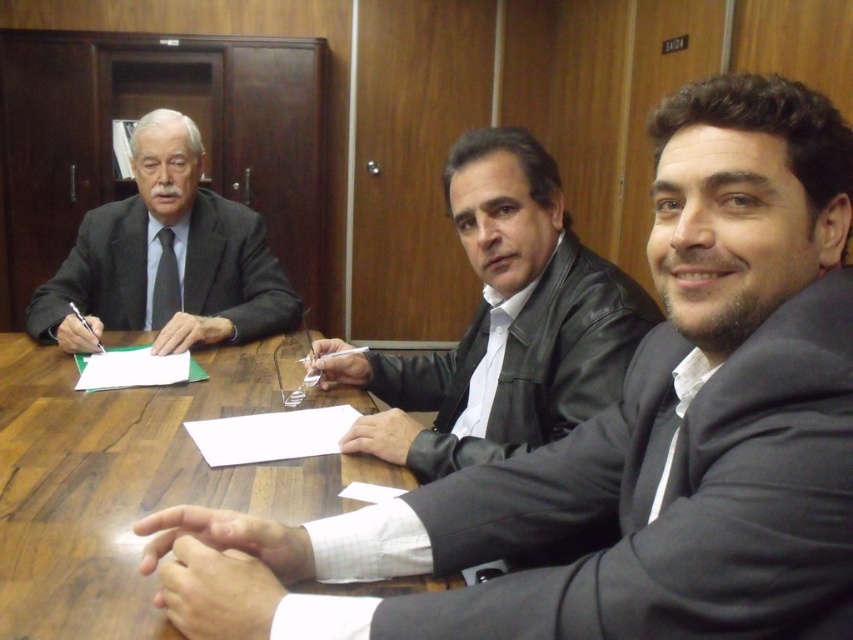
Question: Does leather jacket at center lie in front of matte black suit at left?

Choices:
 (A) yes
 (B) no

Answer: (A)

Question: Which is farther from the leather jacket at center?

Choices:
 (A) wooden table at center
 (B) matte black suit at left

Answer: (B)

Question: Which object appears farthest from the camera in this image?

Choices:
 (A) leather jacket at center
 (B) wooden table at center

Answer: (A)

Question: Is leather jacket at center thinner than matte black suit at left?

Choices:
 (A) no
 (B) yes

Answer: (B)

Question: Does leather jacket at center lie behind matte black suit at left?

Choices:
 (A) no
 (B) yes

Answer: (A)

Question: Which point appears farthest from the camera in this image?

Choices:
 (A) (137, 397)
 (B) (273, 308)
 (C) (355, 433)

Answer: (B)